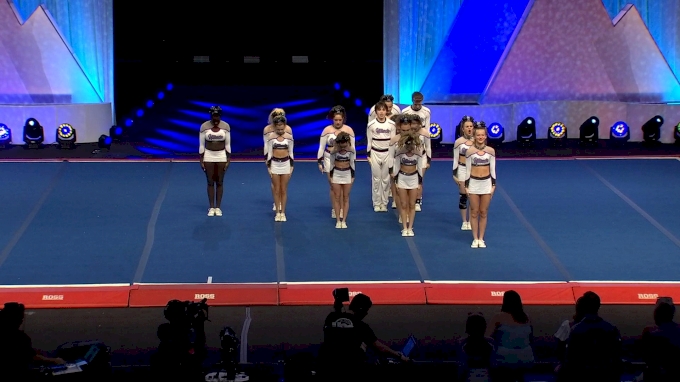
Identify the location of stage lights at left. (44, 140).